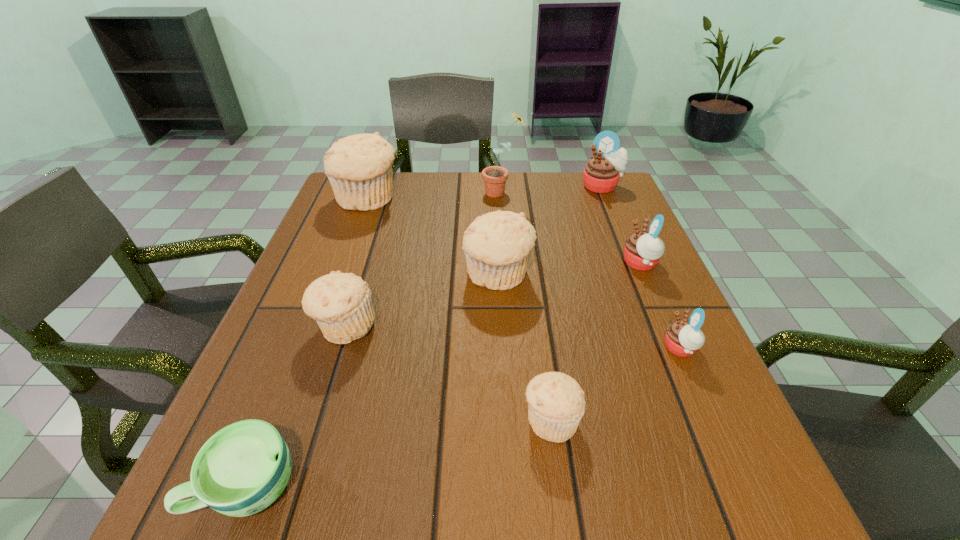
What are the coordinates of `object that is at the near left corner` in the screenshot? It's located at (243, 468).

Where is `object present at the far right corner`? object present at the far right corner is located at coordinates (602, 172).

Identify the location of vacant space at the far edge. This screenshot has width=960, height=540. (520, 198).

The width and height of the screenshot is (960, 540). In the image, there is a desktop. Find the location of `vacant space at the near edge`. vacant space at the near edge is located at coordinates (410, 524).

The height and width of the screenshot is (540, 960). I want to click on free space at the left edge of the desktop, so click(290, 429).

Identify the location of vacant space at the right edge. The width and height of the screenshot is (960, 540). (631, 312).

Image resolution: width=960 pixels, height=540 pixels. Find the location of `vacant space at the far right corner of the desktop`. vacant space at the far right corner of the desktop is located at coordinates coord(605,211).

At what (x,y) coordinates should I click in order to perform the action: click on free space at the near right corner of the desktop. Please return your answer as a coordinate pair (x, y). Looking at the image, I should click on (750, 517).

Locate an element on the screen. The height and width of the screenshot is (540, 960). unoccupied area between the tallest object and the second smallest beige muffin is located at coordinates (423, 259).

This screenshot has width=960, height=540. Find the location of `empty space between the second smallest beige muffin and the second farthest beige muffin`. empty space between the second smallest beige muffin and the second farthest beige muffin is located at coordinates (421, 301).